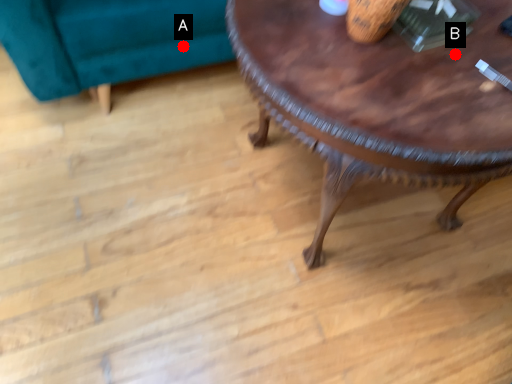
Question: Two points are circled on the image, labeled by A and B beside each circle. Which point appears farthest from the camera in this image?

Choices:
 (A) A is further
 (B) B is further

Answer: (A)